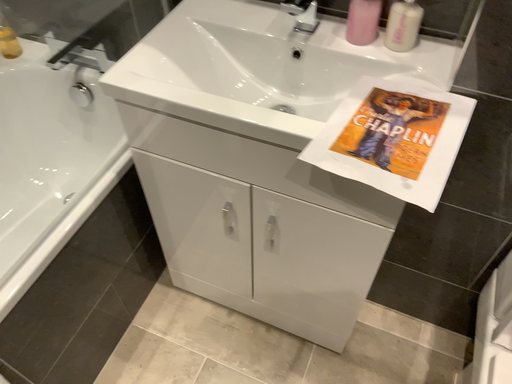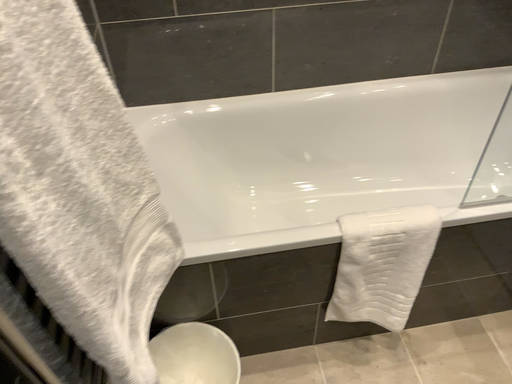
Question: How did the camera likely rotate when shooting the video?

Choices:
 (A) rotated right
 (B) rotated left

Answer: (B)